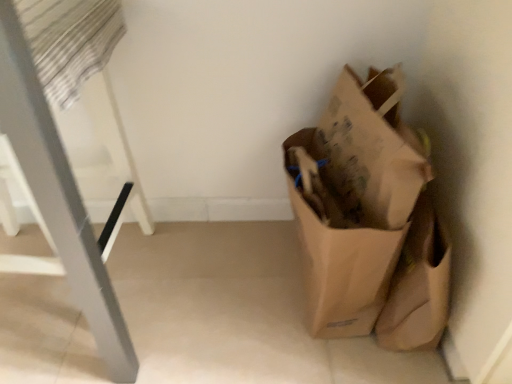
Where is `vacant space that is to the left of brown paper bag at right`? The height and width of the screenshot is (384, 512). vacant space that is to the left of brown paper bag at right is located at coordinates click(225, 291).